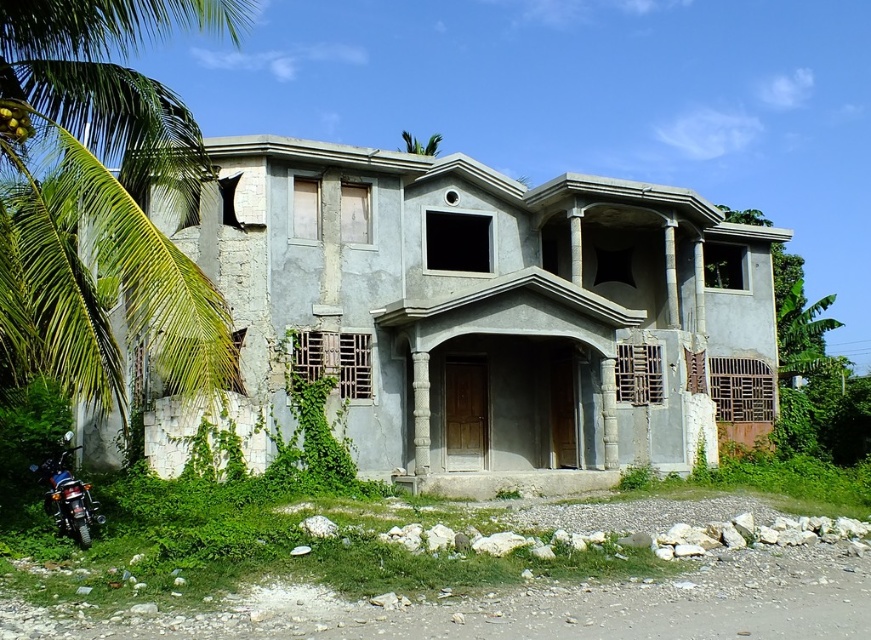
Question: Can you confirm if green leafy palm tree at left is positioned to the right of shiny black motorbike at lower left?

Choices:
 (A) yes
 (B) no

Answer: (B)

Question: Which of the following is the farthest from the observer?

Choices:
 (A) green leafy palm tree at left
 (B) shiny black motorbike at lower left

Answer: (B)

Question: Can you confirm if green leafy palm tree at left is wider than shiny black motorbike at lower left?

Choices:
 (A) no
 (B) yes

Answer: (B)

Question: In this image, where is green leafy palm tree at left located relative to shiny black motorbike at lower left?

Choices:
 (A) left
 (B) right

Answer: (A)

Question: Among these points, which one is nearest to the camera?

Choices:
 (A) (63, 497)
 (B) (192, 320)

Answer: (B)

Question: Among these objects, which one is farthest from the camera?

Choices:
 (A) shiny black motorbike at lower left
 (B) green leafy palm tree at left

Answer: (A)